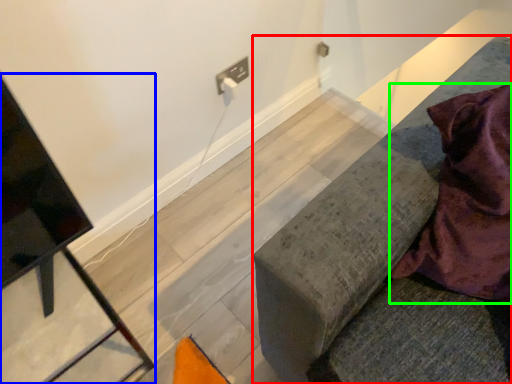
Question: Estimate the real-world distances between objects in this image. Which object is closer to furniture (highlighted by a red box), furniture (highlighted by a blue box) or blanket (highlighted by a green box)?

Choices:
 (A) furniture
 (B) blanket

Answer: (B)